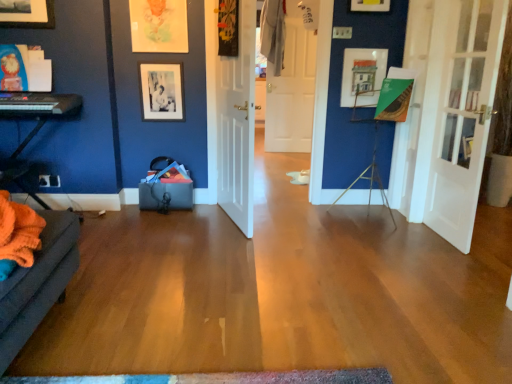
Locate an element on the screen. The width and height of the screenshot is (512, 384). free point to the right of white wooden door at center, which ranks as the second door in front-to-back order is located at coordinates (283, 217).